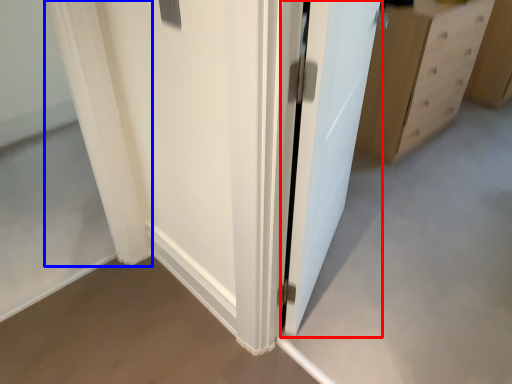
Question: Which of the following is the closest to the observer, door (highlighted by a red box) or curtain (highlighted by a blue box)?

Choices:
 (A) door
 (B) curtain

Answer: (A)